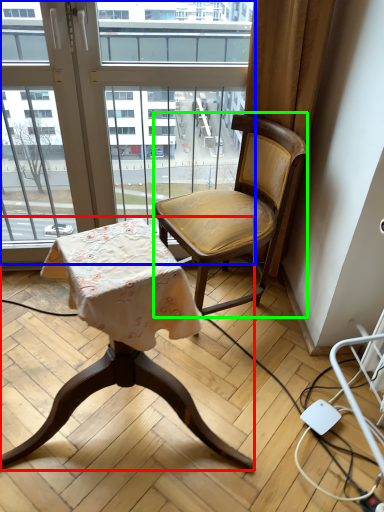
Question: Which is nearer to the chair (highlighted by a red box)? window (highlighted by a blue box) or chair (highlighted by a green box).

Choices:
 (A) window
 (B) chair

Answer: (B)